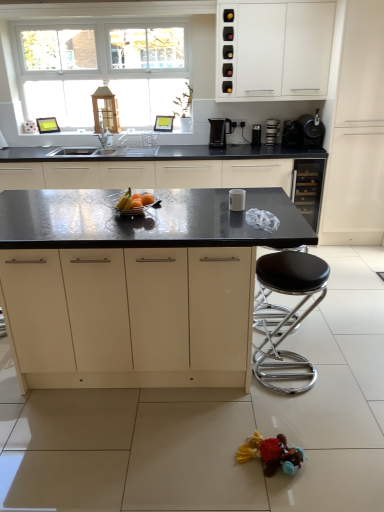
Question: From the image's perspective, relative to metallic silver coffee maker at upper right, acting as the 4th appliance starting from the bottom, is shiny metallic bowl at center above or below?

Choices:
 (A) above
 (B) below

Answer: (B)

Question: Is shiny metallic bowl at center spatially inside metallic silver coffee maker at upper right, placed as the third appliance when sorted from left to right, or outside of it?

Choices:
 (A) outside
 (B) inside

Answer: (A)

Question: Estimate the real-world distances between objects in this image. Which object is closer to the black plastic coffee machine at upper center?

Choices:
 (A) black plastic toaster at upper center, acting as the 2th appliance starting from the top
 (B) matte black countertop at center, which is the 2th cabinetry from left to right
 (C) metallic silver bowl at center
 (D) metallic silver coffee maker at upper right, acting as the 4th appliance starting from the bottom
 (E) white glossy cup at center, which appears as the 1th appliance when viewed from the left

Answer: (A)

Question: Estimate the real-world distances between objects in this image. Which object is farther from the multicolored fabric toy at lower right?

Choices:
 (A) metallic silver coffee maker at upper right, positioned as the second appliance in right-to-left order
 (B) black granite countertop at center, which appears as the first cabinetry when viewed from the left
 (C) black glass wine cooler at right, which is the 4th cabinetry from left to right
 (D) shiny metallic bowl at center
 (E) black plastic coffee maker at upper right, which is counted as the third appliance, starting from the top

Answer: (A)